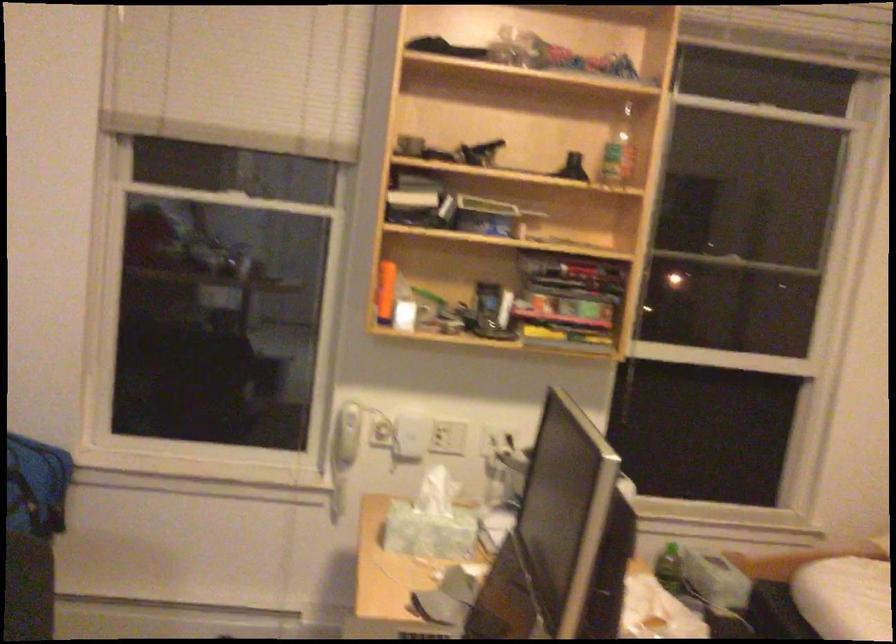
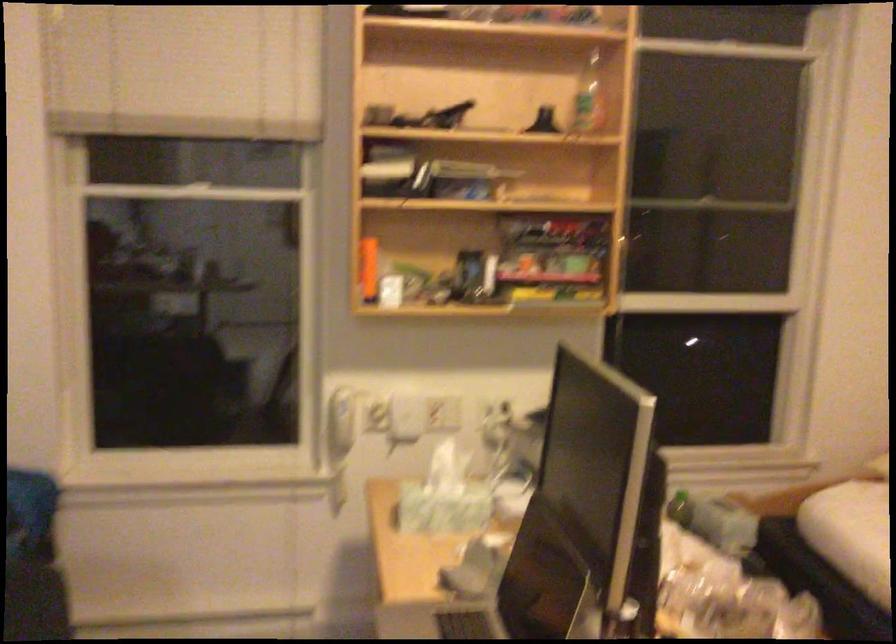
Question: In a continuous first-person perspective shot, in which direction is the camera moving?

Choices:
 (A) Left
 (B) Right
 (C) Forward
 (D) Backward

Answer: (A)